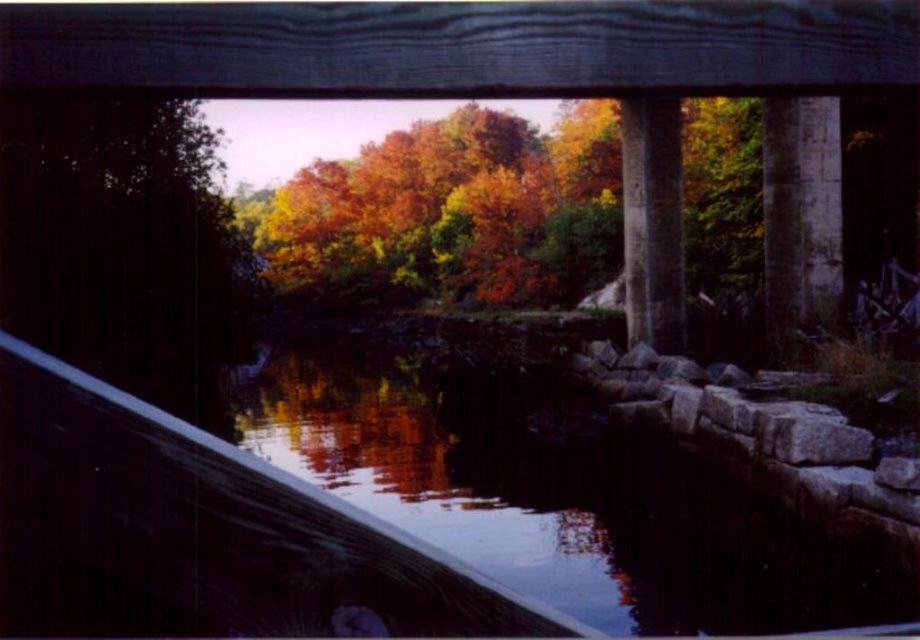
You are a photographer standing at the edge of the wooden railing. You want to capture a photo that includes both the smooth stone river at center and the gray concrete pillar at right. Which object should you adjust your camera angle to include first if you need to ensure both are fully visible in the frame?

The smooth stone river at center might be wider than gray concrete pillar at right, so you should adjust your camera angle to include the smooth stone river at center first to ensure both fit in the frame.